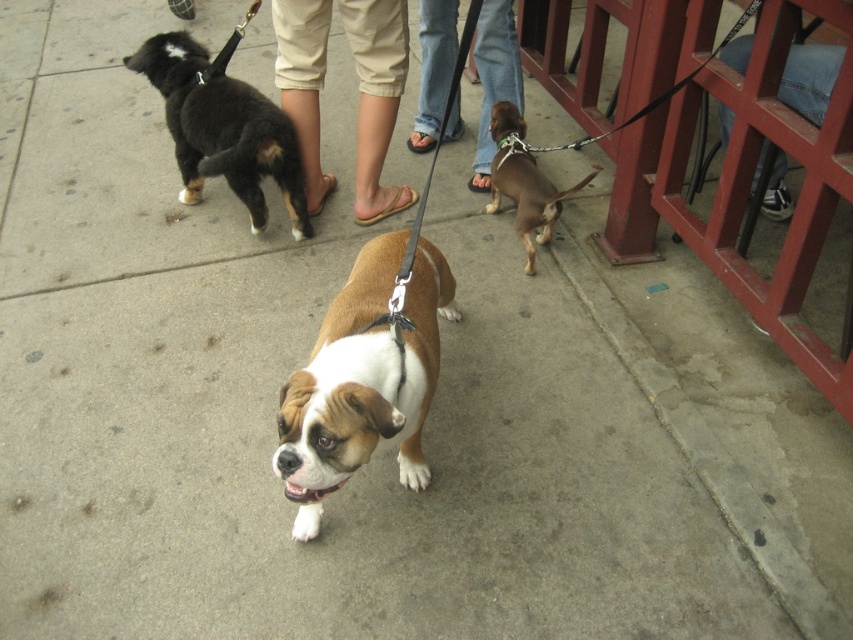
Does point (318, 424) lie behind point (247, 147)?

No, it is not.

Locate an element on the screen. brown/white fur dog at center is located at coordinates (363, 380).

Is brown/white fur dog at center smaller than brown smooth dog at center?

Incorrect, brown/white fur dog at center is not smaller in size than brown smooth dog at center.

Is brown/white fur dog at center bigger than brown smooth dog at center?

Yes.

The height and width of the screenshot is (640, 853). I want to click on brown/white fur dog at center, so click(363, 380).

The image size is (853, 640). In order to click on brown/white fur dog at center in this screenshot , I will do `click(363, 380)`.

Can you confirm if brown leather shoes at center is smaller than brown smooth dog at center?

No.

Is point (421, 67) positioned after point (531, 269)?

Yes.

Locate an element on the screen. brown leather shoes at center is located at coordinates (494, 77).